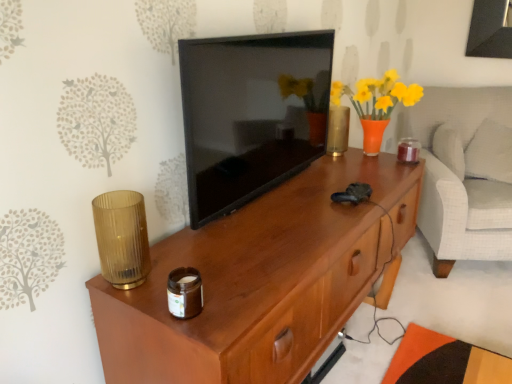
This screenshot has height=384, width=512. I want to click on white soft pillow at right, so click(x=490, y=153).

Image resolution: width=512 pixels, height=384 pixels. What do you see at coordinates (262, 280) in the screenshot? I see `wooden desk at center` at bounding box center [262, 280].

Measure the distance between point (x=416, y=146) and camera.

A distance of 2.59 meters exists between point (x=416, y=146) and camera.

Where is `white soft pillow at right`? This screenshot has width=512, height=384. white soft pillow at right is located at coordinates (490, 153).

From a real-world perspective, does brown glass jar at lower center, the 3th candle holder positioned from the back, sit lower than translucent amber glass candle at right, which appears as the 1th candle holder when viewed from the top?

Yes, from a real-world perspective, brown glass jar at lower center, the 3th candle holder positioned from the back, is under translucent amber glass candle at right, which appears as the 1th candle holder when viewed from the top.

Between point (188, 274) and point (407, 157), which one is positioned in front?

The point (188, 274) is in front.

Is brown glass jar at lower center, which is the 1th candle holder from front to back, far away from translucent amber glass candle at right, acting as the third candle holder starting from the front?

Indeed, brown glass jar at lower center, which is the 1th candle holder from front to back, is not near translucent amber glass candle at right, acting as the third candle holder starting from the front.

How far apart are brown glass jar at lower center, which is counted as the 1th candle holder, starting from the bottom, and translucent amber glass candle at right, which ranks as the third candle holder in bottom-to-top order?

brown glass jar at lower center, which is counted as the 1th candle holder, starting from the bottom, and translucent amber glass candle at right, which ranks as the third candle holder in bottom-to-top order, are 4.26 feet apart from each other.

Does amber ribbed glass at left, acting as the 2th candle holder starting from the bottom, have a greater height compared to wooden desk at center?

No, amber ribbed glass at left, acting as the 2th candle holder starting from the bottom, is not taller than wooden desk at center.

From the image's perspective, which one is positioned higher, amber ribbed glass at left, acting as the 2th candle holder starting from the top, or wooden desk at center?

From the image's view, amber ribbed glass at left, acting as the 2th candle holder starting from the top, is above.

Is amber ribbed glass at left, acting as the 2th candle holder starting from the top, next to wooden desk at center and touching it?

There is a gap between amber ribbed glass at left, acting as the 2th candle holder starting from the top, and wooden desk at center.

Is amber ribbed glass at left, acting as the 2th candle holder starting from the top, inside or outside of wooden desk at center?

amber ribbed glass at left, acting as the 2th candle holder starting from the top, is not inside wooden desk at center, it's outside.

Is white fabric armchair at right completely or partially outside of translucent amber glass candle at right, acting as the third candle holder starting from the front?

Yes, white fabric armchair at right is located beyond the bounds of translucent amber glass candle at right, acting as the third candle holder starting from the front.

Is white fabric armchair at right looking in the opposite direction of translucent amber glass candle at right, which is counted as the first candle holder, starting from the right?

No, white fabric armchair at right is not facing away from translucent amber glass candle at right, which is counted as the first candle holder, starting from the right.

Is white fabric armchair at right in front of or behind translucent amber glass candle at right, which is counted as the first candle holder, starting from the right, in the image?

white fabric armchair at right is positioned farther from the viewer than translucent amber glass candle at right, which is counted as the first candle holder, starting from the right.

There is a white fabric armchair at right. Where is `the 2nd candle holder above it (from a real-world perspective)`? Image resolution: width=512 pixels, height=384 pixels. the 2nd candle holder above it (from a real-world perspective) is located at coordinates (408, 150).

Which object is positioned more to the left, white soft pillow at right or translucent amber glass candle at right, the 1th candle holder viewed from the back?

translucent amber glass candle at right, the 1th candle holder viewed from the back.

From the picture: From a real-world perspective, does white soft pillow at right sit lower than translucent amber glass candle at right, which is counted as the first candle holder, starting from the right?

Yes, from a real-world perspective, white soft pillow at right is under translucent amber glass candle at right, which is counted as the first candle holder, starting from the right.

From their relative heights in the image, would you say white soft pillow at right is taller or shorter than translucent amber glass candle at right, the 1th candle holder viewed from the back?

Considering their sizes, white soft pillow at right has more height than translucent amber glass candle at right, the 1th candle holder viewed from the back.

Which is in front, point (509, 147) or point (406, 156)?

Positioned in front is point (406, 156).

Looking at this image, is white fabric armchair at right turned away from wooden desk at center?

white fabric armchair at right does not have its back to wooden desk at center.

Is point (503, 186) positioned before point (364, 211)?

No, it is not.

Is the surface of white fabric armchair at right in direct contact with wooden desk at center?

They are not placed beside each other.

Between white fabric armchair at right and wooden desk at center, which one has more height?

white fabric armchair at right.

Does black glossy tv at center appear on the right side of translucent amber glass candle at right, which ranks as the third candle holder in bottom-to-top order?

No, black glossy tv at center is not to the right of translucent amber glass candle at right, which ranks as the third candle holder in bottom-to-top order.

In the scene shown: Are black glossy tv at center and translucent amber glass candle at right, the 3th candle holder viewed from the left, making contact?

No, black glossy tv at center is not next to translucent amber glass candle at right, the 3th candle holder viewed from the left.

Considering the positions of objects black glossy tv at center and translucent amber glass candle at right, the 1th candle holder viewed from the back, in the image provided, who is in front, black glossy tv at center or translucent amber glass candle at right, the 1th candle holder viewed from the back,?

black glossy tv at center.

From the image's perspective, who appears lower, black glossy tv at center or translucent amber glass candle at right, the 3th candle holder viewed from the left?

translucent amber glass candle at right, the 3th candle holder viewed from the left, appears lower in the image.

Looking at this image, which is nearer, (403, 140) or (480, 156)?

Clearly, point (403, 140) is more distant from the camera than point (480, 156).

Can we say translucent amber glass candle at right, which ranks as the third candle holder in bottom-to-top order, lies outside white soft pillow at right?

Yes, translucent amber glass candle at right, which ranks as the third candle holder in bottom-to-top order, is not within white soft pillow at right.

Is translucent amber glass candle at right, the 1th candle holder viewed from the back, next to white soft pillow at right?

translucent amber glass candle at right, the 1th candle holder viewed from the back, and white soft pillow at right are not in contact.

How different are the orientations of translucent amber glass candle at right, which ranks as the third candle holder in bottom-to-top order, and white soft pillow at right in degrees?

The facing directions of translucent amber glass candle at right, which ranks as the third candle holder in bottom-to-top order, and white soft pillow at right are 98.6 degrees apart.

I want to click on candle holder on the right of brown glass jar at lower center, the third candle holder from the top, so click(x=408, y=150).

Where is `the 2nd candle holder positioned above the wooden desk at center (from the image's perspective)`? the 2nd candle holder positioned above the wooden desk at center (from the image's perspective) is located at coordinates (122, 238).

When comparing their distances from white fabric armchair at right, does wooden desk at center or brown glass jar at lower center, the 2th candle holder when ordered from right to left, seem further?

The object further to white fabric armchair at right is brown glass jar at lower center, the 2th candle holder when ordered from right to left.

Which object lies further to the anchor point brown glass jar at lower center, the 2th candle holder when ordered from right to left, white soft pillow at right or amber ribbed glass at left, which ranks as the first candle holder in left-to-right order?

white soft pillow at right is further to brown glass jar at lower center, the 2th candle holder when ordered from right to left.

Consider the image. Which object lies nearer to the anchor point white soft pillow at right, black glossy tv at center or amber ribbed glass at left, acting as the 2th candle holder starting from the top?

The object closer to white soft pillow at right is black glossy tv at center.

Based on their spatial positions, is brown glass jar at lower center, the third candle holder from the top, or wooden desk at center further from translucent amber glass candle at right, which is counted as the first candle holder, starting from the right?

brown glass jar at lower center, the third candle holder from the top, is further to translucent amber glass candle at right, which is counted as the first candle holder, starting from the right.

Looking at the image, which one is located closer to wooden desk at center, black glossy tv at center or white soft pillow at right?

black glossy tv at center lies closer to wooden desk at center than the other object.

Looking at this image, based on their spatial positions, is translucent amber glass candle at right, which is counted as the first candle holder, starting from the right, or brown glass jar at lower center, the 3th candle holder positioned from the back, further from black glossy tv at center?

The object further to black glossy tv at center is translucent amber glass candle at right, which is counted as the first candle holder, starting from the right.

When comparing their distances from brown glass jar at lower center, which is counted as the 1th candle holder, starting from the bottom, does white fabric armchair at right or amber ribbed glass at left, which ranks as the 2th candle holder in back-to-front order, seem closer?

amber ribbed glass at left, which ranks as the 2th candle holder in back-to-front order, lies closer to brown glass jar at lower center, which is counted as the 1th candle holder, starting from the bottom, than the other object.

Which object lies further to the anchor point white fabric armchair at right, white soft pillow at right or black glossy tv at center?

Based on the image, black glossy tv at center appears to be further to white fabric armchair at right.

Image resolution: width=512 pixels, height=384 pixels. In order to click on desk situated between amber ribbed glass at left, which ranks as the first candle holder in left-to-right order, and white fabric armchair at right from left to right in this screenshot , I will do [262, 280].

Find the location of a particular element. The width and height of the screenshot is (512, 384). television between amber ribbed glass at left, which ranks as the 2th candle holder in back-to-front order, and white soft pillow at right from left to right is located at coordinates (251, 114).

Where is `candle holder located between brown glass jar at lower center, the third candle holder from the top, and white fabric armchair at right in the left-right direction`? candle holder located between brown glass jar at lower center, the third candle holder from the top, and white fabric armchair at right in the left-right direction is located at coordinates (408, 150).

What are the coordinates of `candle holder located between black glossy tv at center and white soft pillow at right in the left-right direction` in the screenshot? It's located at (408, 150).